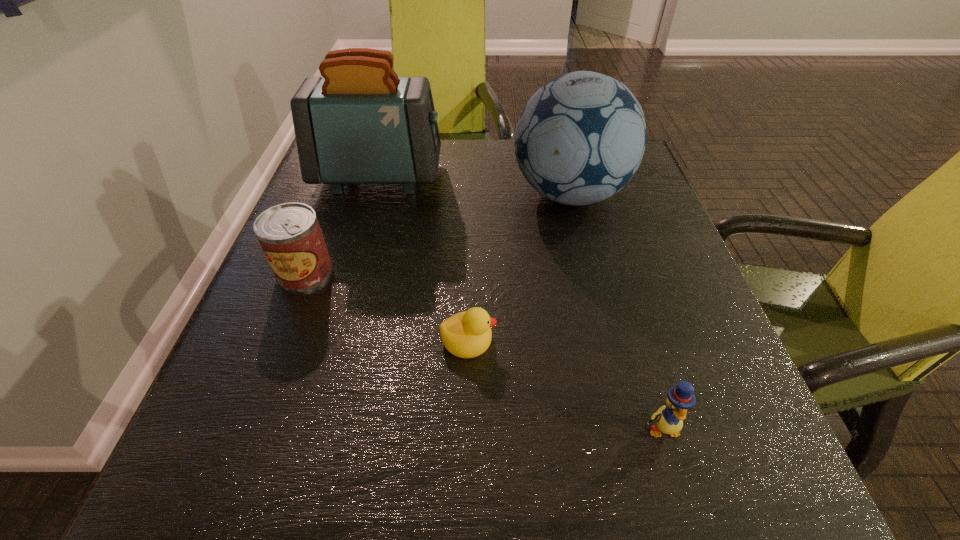
The image size is (960, 540). I want to click on toaster, so click(359, 123).

Locate an element on the screen. This screenshot has width=960, height=540. soccer ball is located at coordinates (581, 137).

The width and height of the screenshot is (960, 540). Find the location of `the third shortest object`. the third shortest object is located at coordinates (290, 235).

Locate an element on the screen. This screenshot has height=540, width=960. the third nearest object is located at coordinates (290, 235).

I want to click on the taller duckling, so click(668, 419).

At what (x,y) coordinates should I click in order to perform the action: click on the nearest object. Please return your answer as a coordinate pair (x, y). The width and height of the screenshot is (960, 540). Looking at the image, I should click on (668, 419).

This screenshot has height=540, width=960. Find the location of `the shorter duckling`. the shorter duckling is located at coordinates (467, 334).

This screenshot has width=960, height=540. I want to click on the shortest object, so click(x=467, y=334).

In order to click on vacant area situated 0.190m on the front-facing side of the toaster in this screenshot , I will do `click(518, 177)`.

Locate an element on the screen. vacant region located 0.050m on the side with brand of the soccer ball is located at coordinates (490, 194).